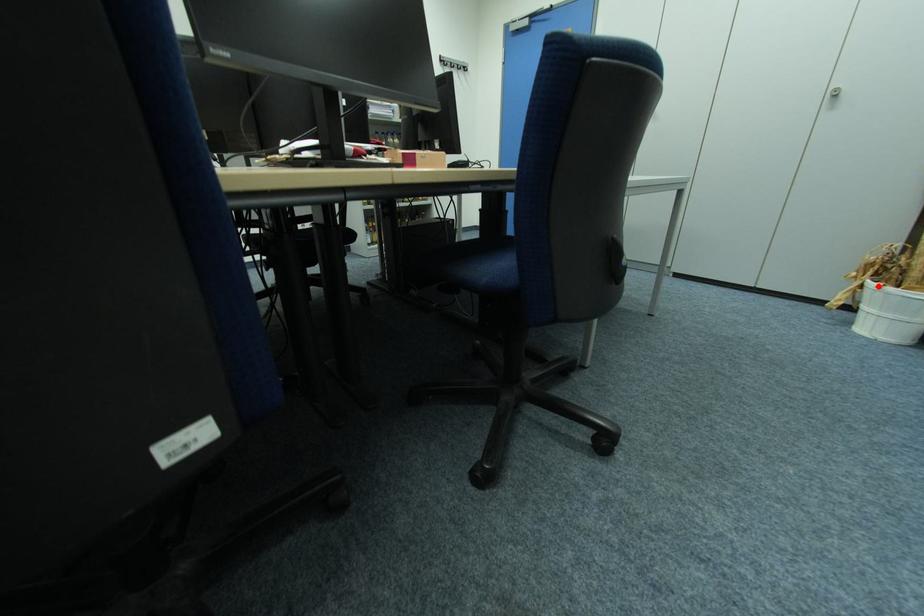
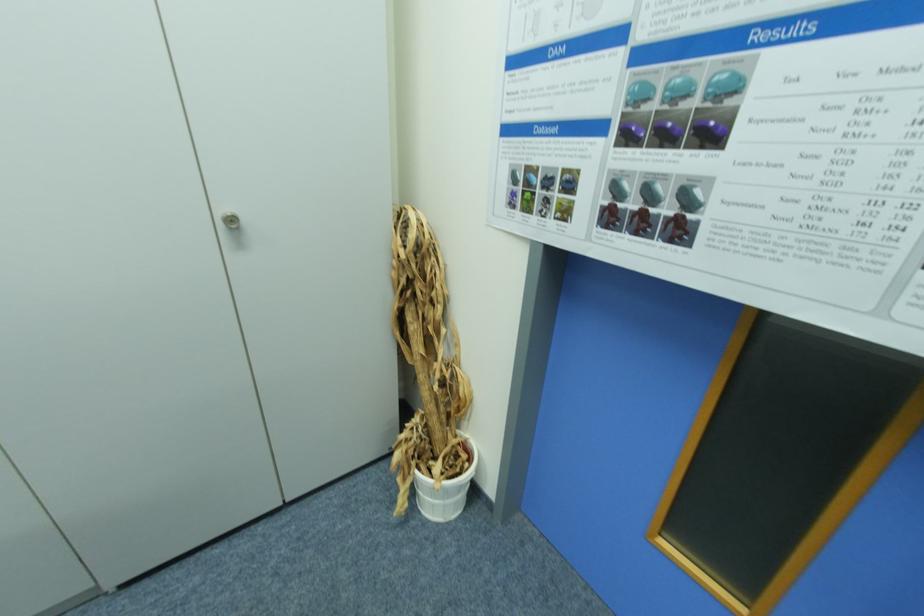
Question: I am providing you with two images of the same scene from different viewpoints. Given a red point in image1, look at the same physical point in image2. Is it:

Choices:
 (A) Closer to the viewpoint
 (B) Farther from the viewpoint

Answer: (A)